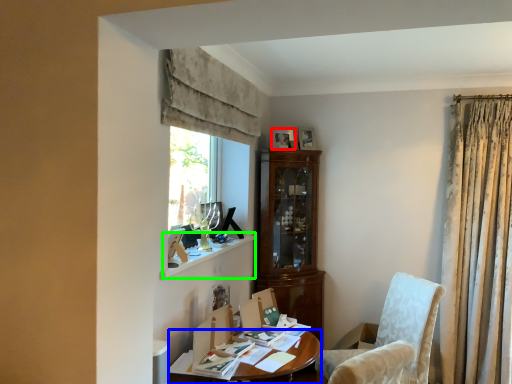
Question: Which object is positioned farthest from picture frame (highlighted by a red box)? Select from desk (highlighted by a blue box) and window sill (highlighted by a green box).

Choices:
 (A) desk
 (B) window sill

Answer: (A)